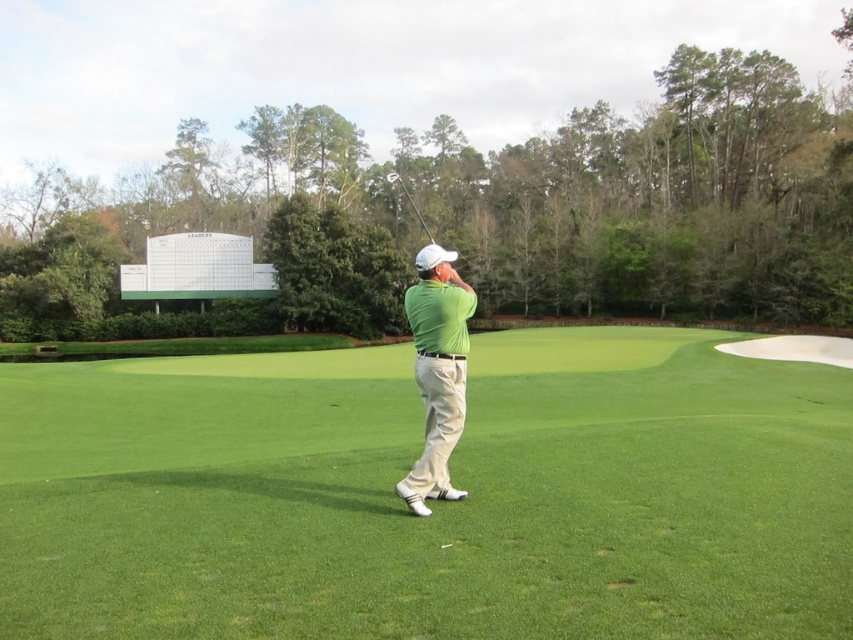
Can you confirm if green matte shirt at center is taller than metallic silver golf club at center?

No.

Does point (440, 344) come farther from viewer compared to point (395, 176)?

No, (440, 344) is in front of (395, 176).

In order to click on green matte shirt at center in this screenshot , I will do `click(437, 371)`.

The height and width of the screenshot is (640, 853). I want to click on green matte shirt at center, so click(x=437, y=371).

Is green grass at center positioned behind metallic silver golf club at center?

No, green grass at center is in front of metallic silver golf club at center.

Is green grass at center smaller than metallic silver golf club at center?

Yes, green grass at center is smaller than metallic silver golf club at center.

Locate an element on the screen. Image resolution: width=853 pixels, height=640 pixels. green grass at center is located at coordinates (433, 502).

Which is above, green grass at center or green matte shirt at center?

green matte shirt at center

Where is `green grass at center`? green grass at center is located at coordinates (433, 502).

This screenshot has width=853, height=640. I want to click on green grass at center, so click(x=433, y=502).